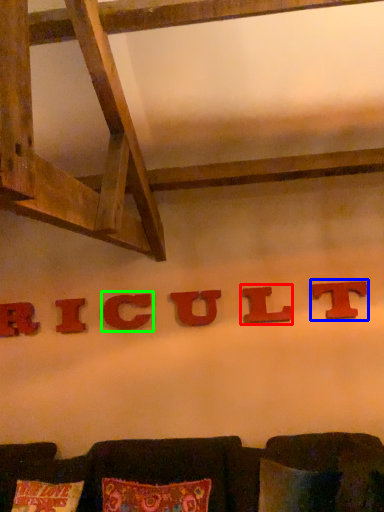
Question: Estimate the real-world distances between objects in this image. Which object is closer to alphabet (highlighted by a red box), alphabet (highlighted by a blue box) or alphabet (highlighted by a green box)?

Choices:
 (A) alphabet
 (B) alphabet

Answer: (A)